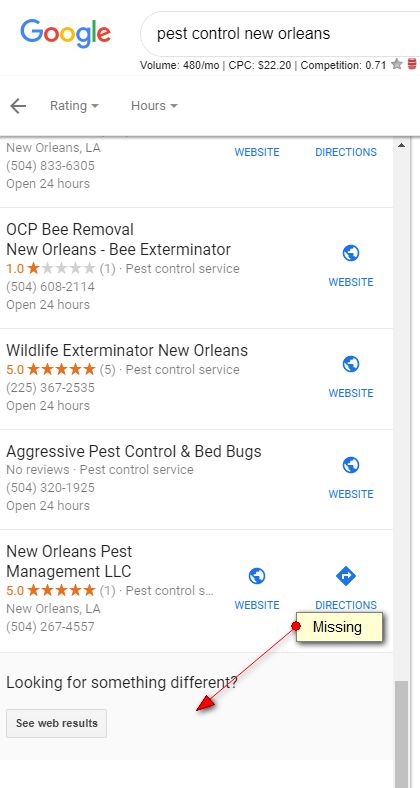
You are a GUI agent. You are given a task and a screenshot of the screen. Output one action in this format:
    pyautogui.click(x=<x>, y=<y>)
    Task: Click on the business phone
    This screenshot has height=788, width=420.
    Given the screenshot: What is the action you would take?
    pyautogui.click(x=53, y=626), pyautogui.click(x=55, y=485), pyautogui.click(x=57, y=392), pyautogui.click(x=37, y=288), pyautogui.click(x=70, y=165)